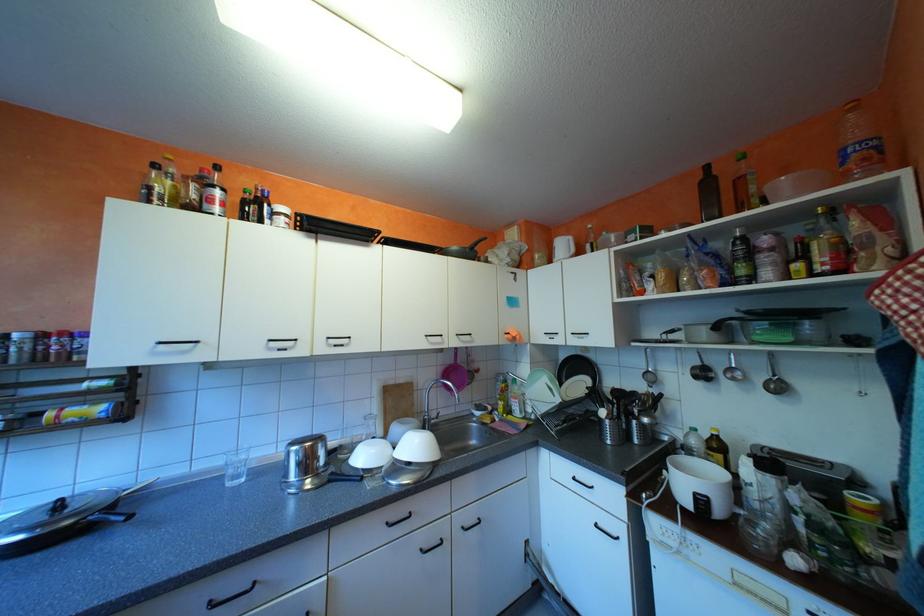
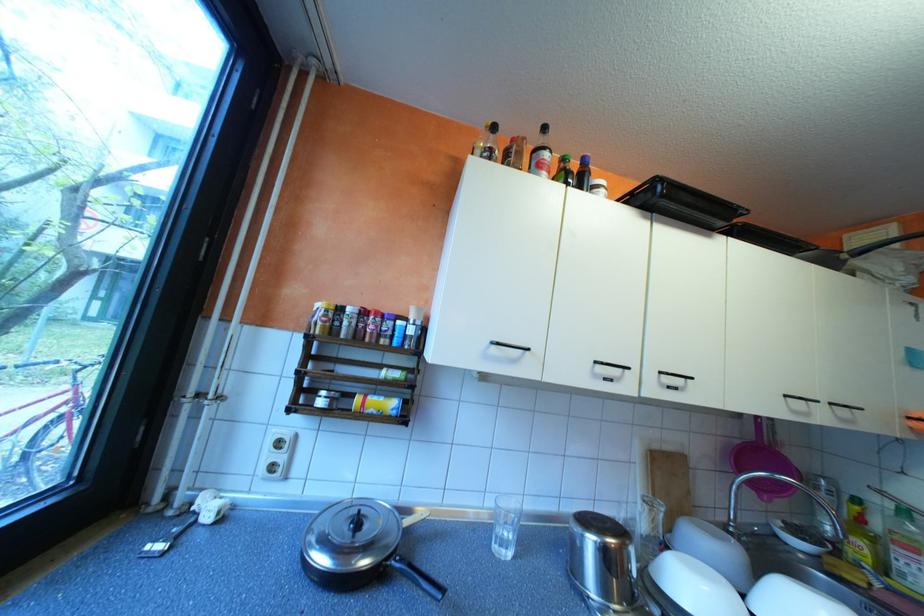
Find the pixel in the second image that matches point 468,334 in the first image.

(843, 403)